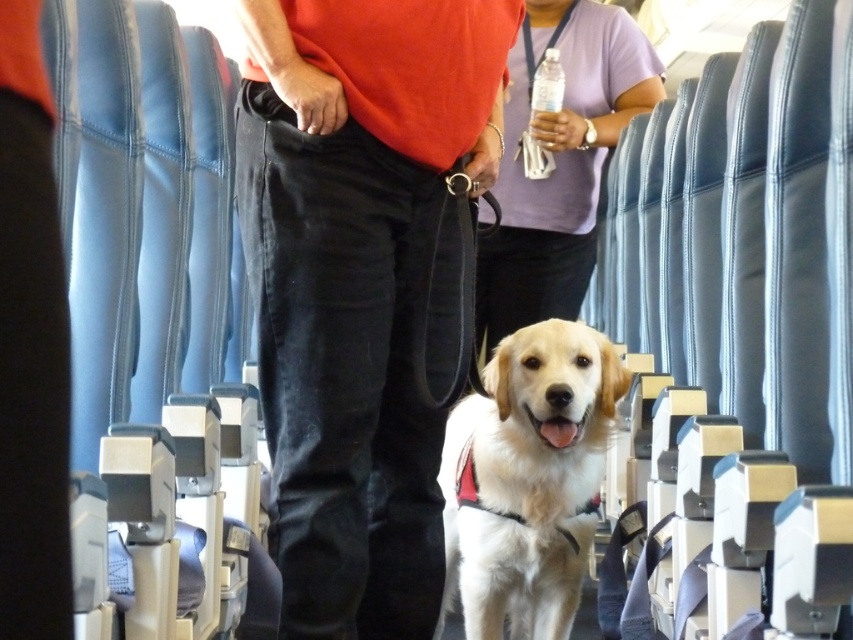
You are a passenger sitting in the airplane cabin. You notice the white fur dog at center and the purple fabric shirt at center. Which object is nearer to you?

The white fur dog at center is closer to the viewer than the purple fabric shirt at center.

You are a passenger sitting at seat 12A in the airplane cabin. You want to reach the dog at the white fur dog at center to pet it. Which direction should you move from your seat to approach the dog?

The white fur dog at center is located at coordinates 0.750 on the x and 0.619 on the y axis. Since you are at seat 12A, you would need to move forward in the cabin to reach the dog.